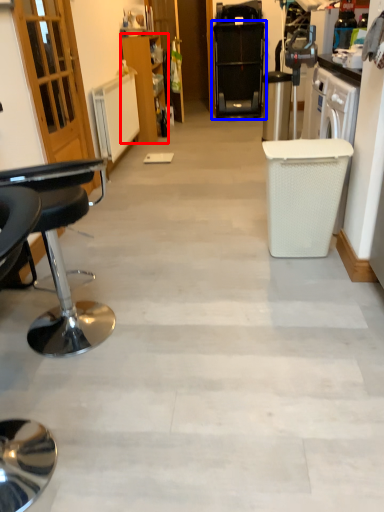
Question: Which object appears closest to the camera in this image, cabinetry (highlighted by a red box) or home appliance (highlighted by a blue box)?

Choices:
 (A) cabinetry
 (B) home appliance

Answer: (A)